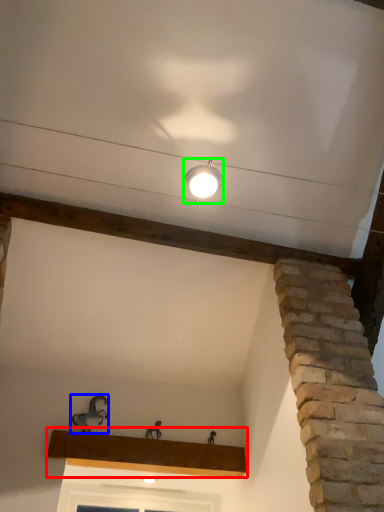
Question: Considering the real-world distances, which object is closest to window sill (highlighted by a red box)? animal (highlighted by a blue box) or lamp (highlighted by a green box).

Choices:
 (A) animal
 (B) lamp

Answer: (A)